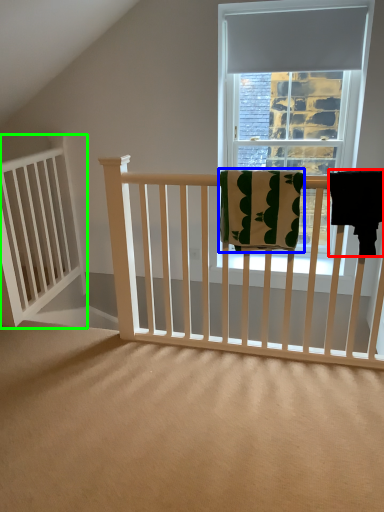
Question: Based on their relative distances, which object is farther from beach towel (highlighted by a red box)? Choose from beach towel (highlighted by a blue box) and balustrade (highlighted by a green box).

Choices:
 (A) beach towel
 (B) balustrade

Answer: (B)